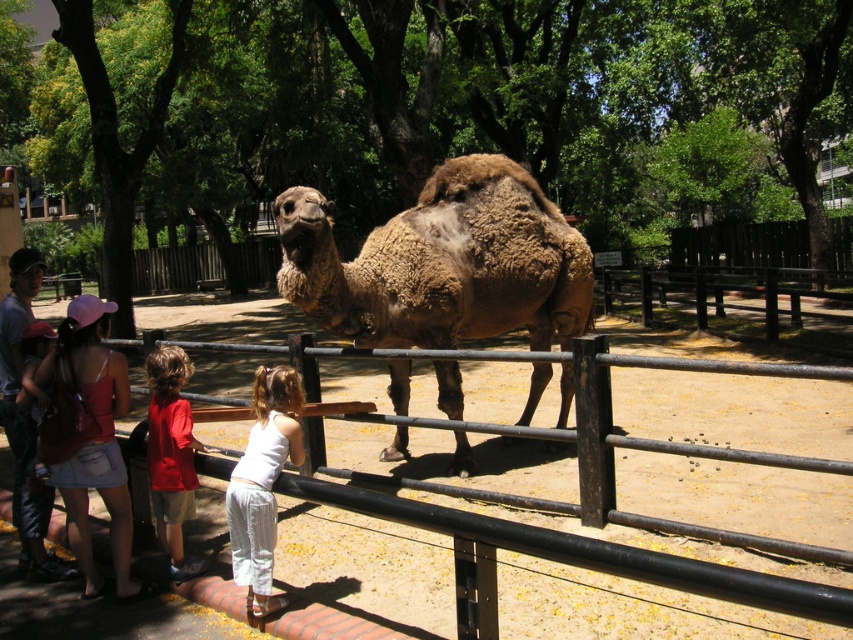
Question: Which object is closer to the camera taking this photo?

Choices:
 (A) black metal fence at center
 (B) denim skirt at lower left
 (C) white striped pants at lower center

Answer: (A)

Question: Considering the relative positions of denim skirt at lower left and red cotton shirt at center in the image provided, where is denim skirt at lower left located with respect to red cotton shirt at center?

Choices:
 (A) right
 (B) left

Answer: (B)

Question: Estimate the real-world distances between objects in this image. Which object is closer to the denim skirt at lower left?

Choices:
 (A) white striped pants at lower center
 (B) red cotton shirt at center
 (C) fuzzy brown camel at center
 (D) black metal fence at center

Answer: (B)

Question: In this image, where is black metal fence at center located relative to white striped pants at lower center?

Choices:
 (A) right
 (B) left

Answer: (A)

Question: Which of these objects is positioned closest to the red cotton shirt at center?

Choices:
 (A) white striped pants at lower center
 (B) fuzzy brown camel at center
 (C) black metal fence at center

Answer: (A)

Question: Is denim skirt at lower left bigger than red cotton shirt at center?

Choices:
 (A) yes
 (B) no

Answer: (B)